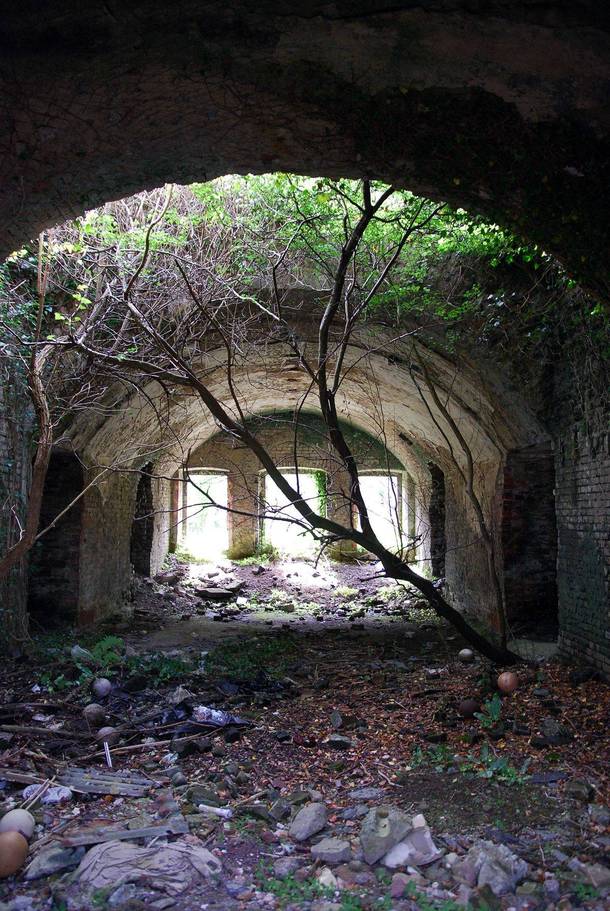
Locate an element on the screen. brick wall is located at coordinates (586, 534), (9, 477).